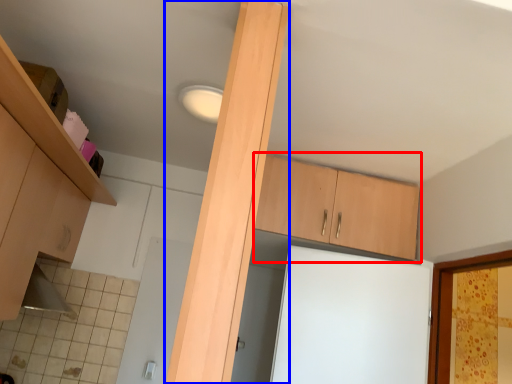
Question: Which object is further to the camera taking this photo, cabinetry (highlighted by a red box) or beam (highlighted by a blue box)?

Choices:
 (A) cabinetry
 (B) beam

Answer: (A)